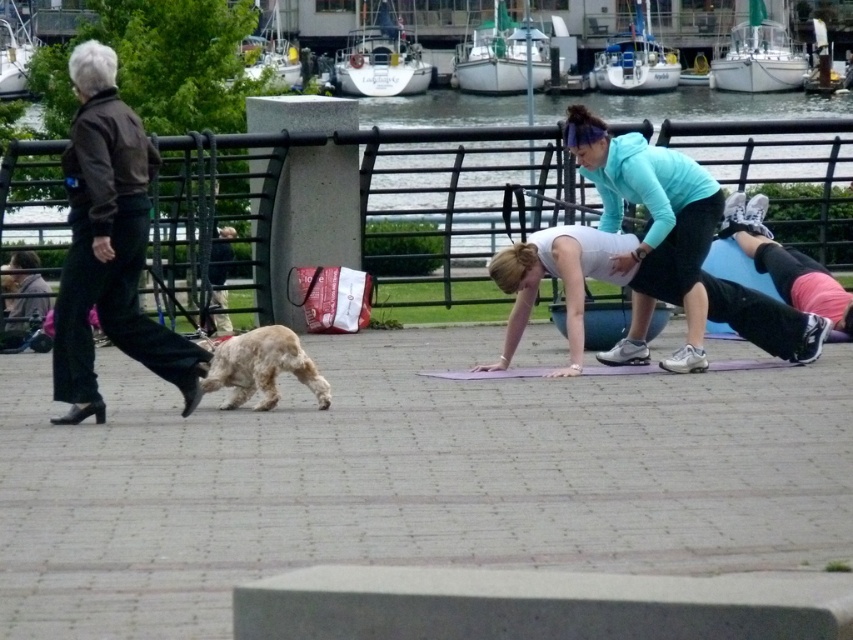
Does white matte yoga mat at center appear on the left side of teal fleece jacket at center?

No, white matte yoga mat at center is not to the left of teal fleece jacket at center.

Which is more to the left, white matte yoga mat at center or teal fleece jacket at center?

teal fleece jacket at center is more to the left.

Find the location of a particular element. Image resolution: width=853 pixels, height=640 pixels. white matte yoga mat at center is located at coordinates (581, 288).

Where is `white matte yoga mat at center`? white matte yoga mat at center is located at coordinates (581, 288).

Looking at this image, who is positioned more to the right, white matte yoga mat at center or purple rubber yoga mat at center?

white matte yoga mat at center is more to the right.

Does white matte yoga mat at center lie in front of purple rubber yoga mat at center?

That is True.

Image resolution: width=853 pixels, height=640 pixels. In order to click on white matte yoga mat at center in this screenshot , I will do `click(581, 288)`.

From the picture: Is the position of white matte yoga mat at center more distant than that of light brown fur at lower left?

That is True.

Does white matte yoga mat at center appear over light brown fur at lower left?

Correct, white matte yoga mat at center is located above light brown fur at lower left.

Who is more forward, [524,324] or [315,387]?

Point [315,387] is more forward.

Where is `white matte yoga mat at center`? This screenshot has width=853, height=640. white matte yoga mat at center is located at coordinates (581, 288).